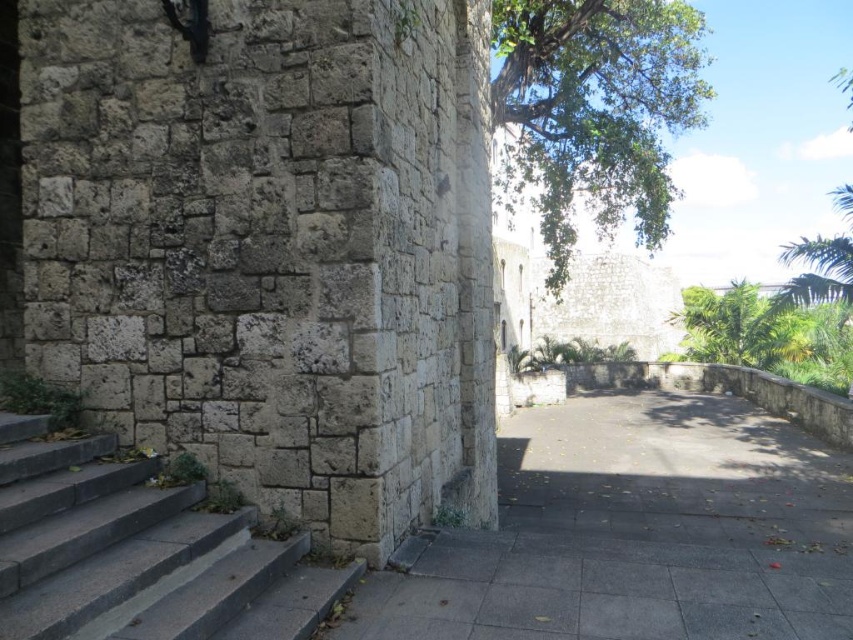
Question: Among these points, which one is farthest from the camera?

Choices:
 (A) (502, 60)
 (B) (749, 344)
 (C) (49, 582)

Answer: (B)

Question: Which point is closer to the camera?

Choices:
 (A) (97, 544)
 (B) (695, 113)
 (C) (688, 337)

Answer: (A)

Question: Is gray concrete stairs at lower left positioned in front of green leafy tree at right?

Choices:
 (A) no
 (B) yes

Answer: (B)

Question: Is gray concrete pavement at lower center further to the viewer compared to gray concrete stairs at lower left?

Choices:
 (A) no
 (B) yes

Answer: (B)

Question: Can you confirm if gray concrete pavement at lower center is smaller than green leafy tree at right?

Choices:
 (A) yes
 (B) no

Answer: (A)

Question: Which point is farther to the camera?

Choices:
 (A) (32, 474)
 (B) (726, 316)

Answer: (B)